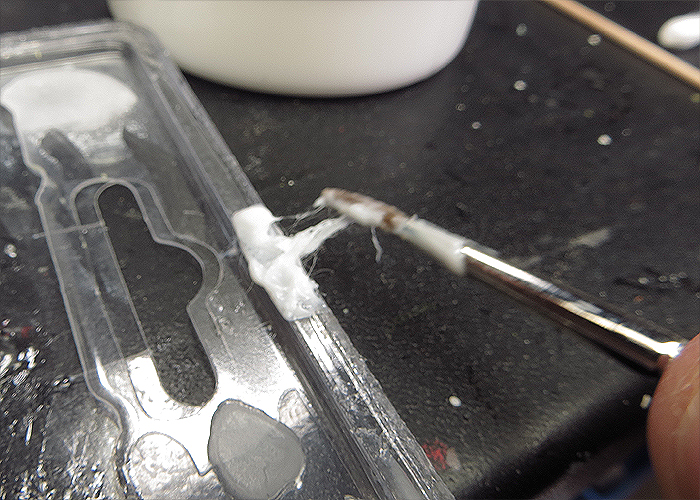
The height and width of the screenshot is (500, 700). What are the coordinates of `white bowl` in the screenshot? It's located at (330, 66).